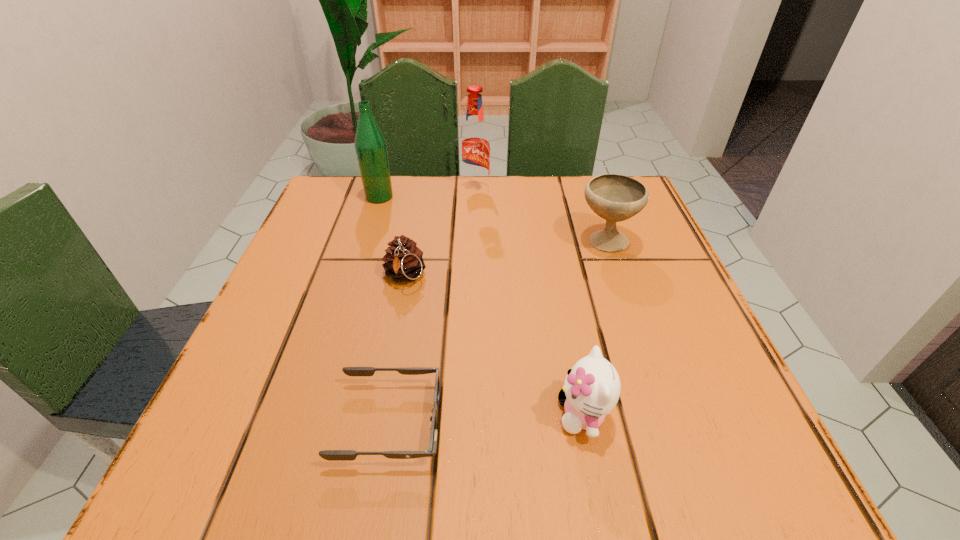
Identify the location of vacant space located 0.330m on the left of the rightmost object. (x=413, y=241).

Identify the location of vacant space located on the front-facing side of the fifth object from left to right. The width and height of the screenshot is (960, 540). (396, 415).

This screenshot has height=540, width=960. In order to click on vacant area located 0.340m on the front-facing side of the fifth object from left to right in this screenshot , I will do `click(308, 415)`.

Find the location of a particular element. vacant space located 0.160m on the front-facing side of the fifth object from left to right is located at coordinates (440, 415).

This screenshot has width=960, height=540. In order to click on free space located with a leaf charm attached to the third nearest object in this screenshot , I will do `click(391, 348)`.

Where is `free spot located on the temples of the sunglasses`? free spot located on the temples of the sunglasses is located at coordinates [x=553, y=423].

Where is `root beer situated at the far edge`? The height and width of the screenshot is (540, 960). root beer situated at the far edge is located at coordinates (475, 144).

Image resolution: width=960 pixels, height=540 pixels. Find the location of `bottle present at the far edge`. bottle present at the far edge is located at coordinates (370, 144).

You are a GUI agent. You are given a task and a screenshot of the screen. Output one action in this format:
    pyautogui.click(x=<x>, y=<y>)
    Task: Click on the chalice that is at the far edge
    The width and height of the screenshot is (960, 540).
    Given the screenshot: What is the action you would take?
    pyautogui.click(x=613, y=197)

Identify the location of kitten located at the near edge. The height and width of the screenshot is (540, 960). (592, 387).